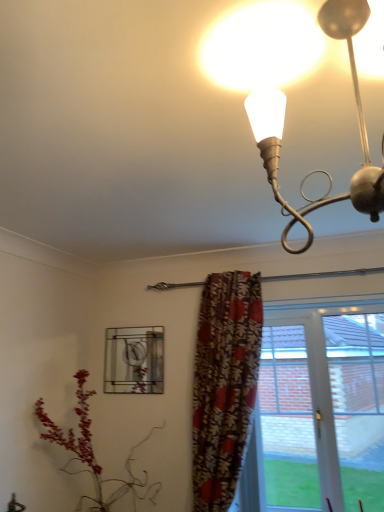
Question: Would you consider floral fabric curtain at center to be distant from stained glass window at center, the 1th window viewed from the left?

Choices:
 (A) no
 (B) yes

Answer: (A)

Question: Does floral fabric curtain at center have a smaller size compared to stained glass window at center, the 2th window from the right?

Choices:
 (A) yes
 (B) no

Answer: (B)

Question: Considering the relative positions of floral fabric curtain at center and stained glass window at center, the 1th window viewed from the left, in the image provided, is floral fabric curtain at center behind stained glass window at center, the 1th window viewed from the left,?

Choices:
 (A) yes
 (B) no

Answer: (B)

Question: From the image's perspective, is floral fabric curtain at center under stained glass window at center, the 2th window from the right?

Choices:
 (A) no
 (B) yes

Answer: (B)

Question: Can you confirm if floral fabric curtain at center is wider than stained glass window at center, the 2th window from the right?

Choices:
 (A) yes
 (B) no

Answer: (A)

Question: Visually, is transparent glass door at center, which is counted as the first window, starting from the right, positioned to the left or to the right of matte white bulb at upper right?

Choices:
 (A) right
 (B) left

Answer: (A)

Question: Based on their sizes in the image, would you say transparent glass door at center, which is counted as the first window, starting from the right, is bigger or smaller than matte white bulb at upper right?

Choices:
 (A) small
 (B) big

Answer: (B)

Question: Is transparent glass door at center, the 2th window positioned from the left, wider or thinner than matte white bulb at upper right?

Choices:
 (A) wide
 (B) thin

Answer: (B)

Question: Is transparent glass door at center, the 2th window positioned from the left, taller or shorter than matte white bulb at upper right?

Choices:
 (A) tall
 (B) short

Answer: (A)

Question: Is transparent glass door at center, the 2th window positioned from the left, inside or outside of floral fabric curtain at center?

Choices:
 (A) inside
 (B) outside

Answer: (B)

Question: Is transparent glass door at center, which is counted as the first window, starting from the right, in front of or behind floral fabric curtain at center in the image?

Choices:
 (A) front
 (B) behind

Answer: (B)

Question: From a real-world perspective, is transparent glass door at center, the 2th window positioned from the left, above or below floral fabric curtain at center?

Choices:
 (A) above
 (B) below

Answer: (B)

Question: Considering the relative positions of transparent glass door at center, the 2th window positioned from the left, and floral fabric curtain at center in the image provided, is transparent glass door at center, the 2th window positioned from the left, to the left or to the right of floral fabric curtain at center?

Choices:
 (A) left
 (B) right

Answer: (B)

Question: Is floral fabric curtain at center wider or thinner than stained glass window at center, the 1th window viewed from the left?

Choices:
 (A) thin
 (B) wide

Answer: (B)

Question: From the image's perspective, relative to stained glass window at center, the 1th window viewed from the left, is floral fabric curtain at center above or below?

Choices:
 (A) below
 (B) above

Answer: (A)